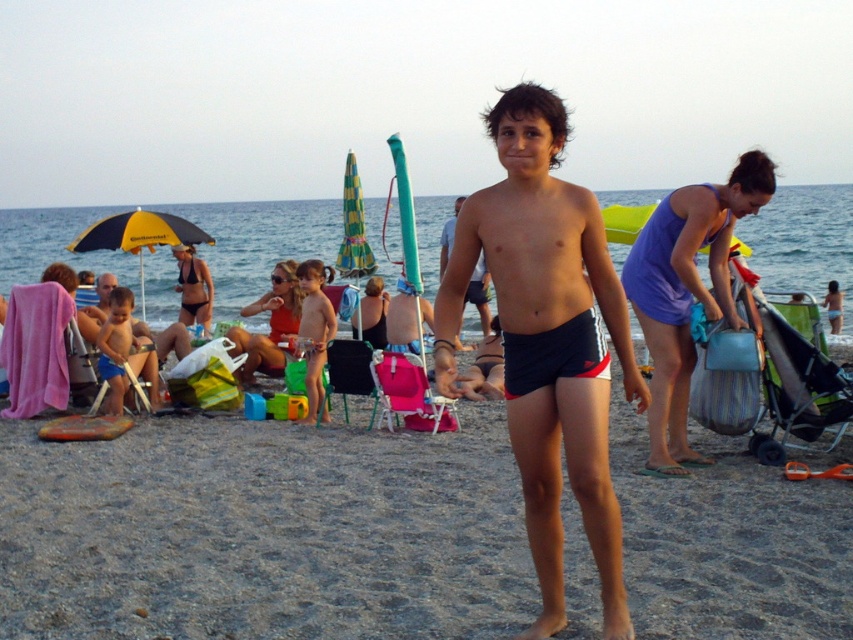
You are standing on the beach and see two points in the scene. The first point is at coordinates point (653, 388) and the second point is at point (320, 266). Which point is closer to you?

Point (653, 388) is closer to the viewer than point (320, 266).

You are a photographer trying to capture a closeup of the black fabric shorts at center and smooth tan skin at center. Which object should you zoom in on to ensure both are in focus without moving the camera?

The black fabric shorts at center is wider than the smooth tan skin at center, so you should zoom in on the black fabric shorts at center to ensure both are in focus without moving the camera.

You are a photographer trying to capture the boy in the center of the beach scene. Which object, the black fabric shorts at center or the smooth tan skin at center, would appear bigger in your photo?

The black fabric shorts at center is larger in size than the smooth tan skin at center, so it would appear bigger in the photo.